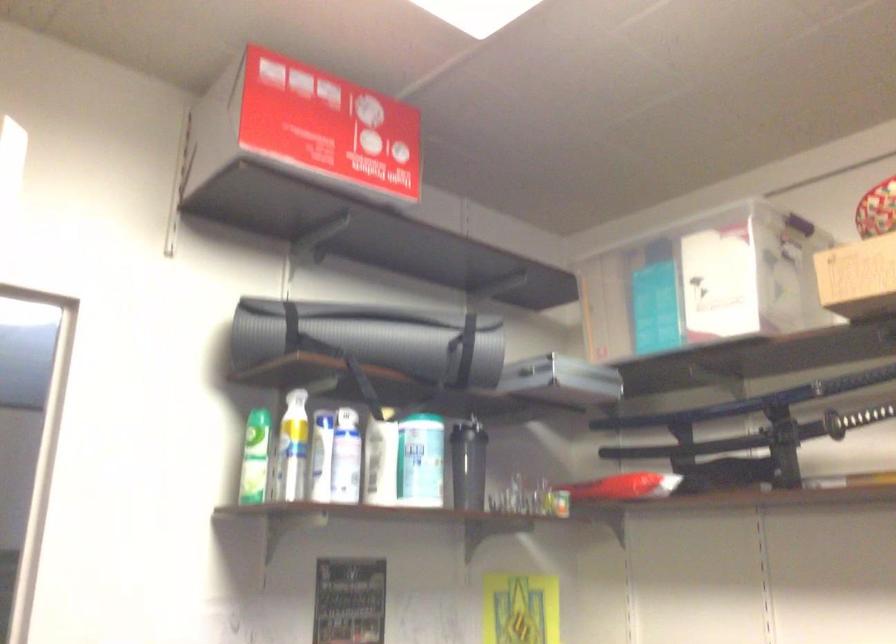
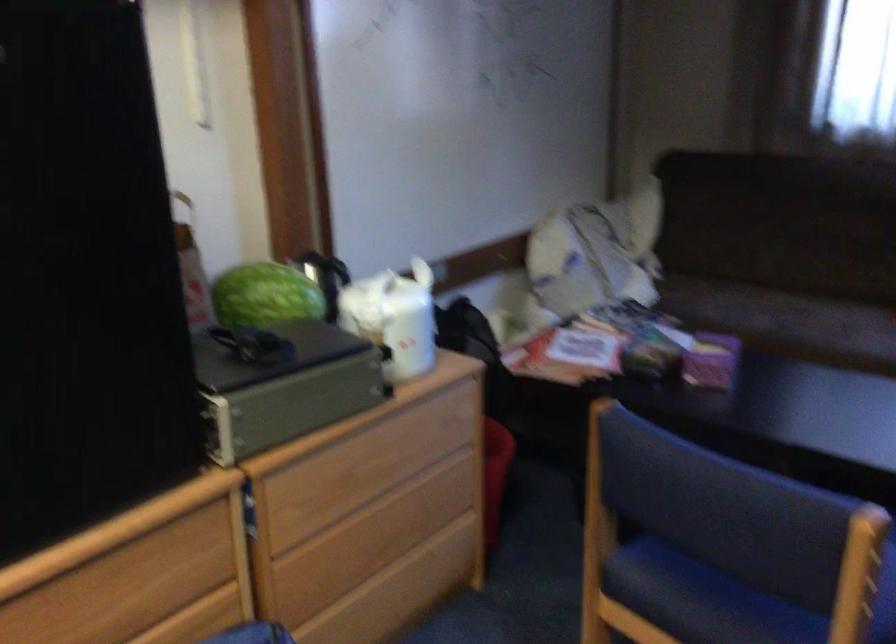
Question: The camera is either moving clockwise (left) or counter-clockwise (right) around the object. The first image is from the beginning of the video and the second image is from the end. Is the camera moving left or right when shooting the video?

Choices:
 (A) Left
 (B) Right

Answer: (A)